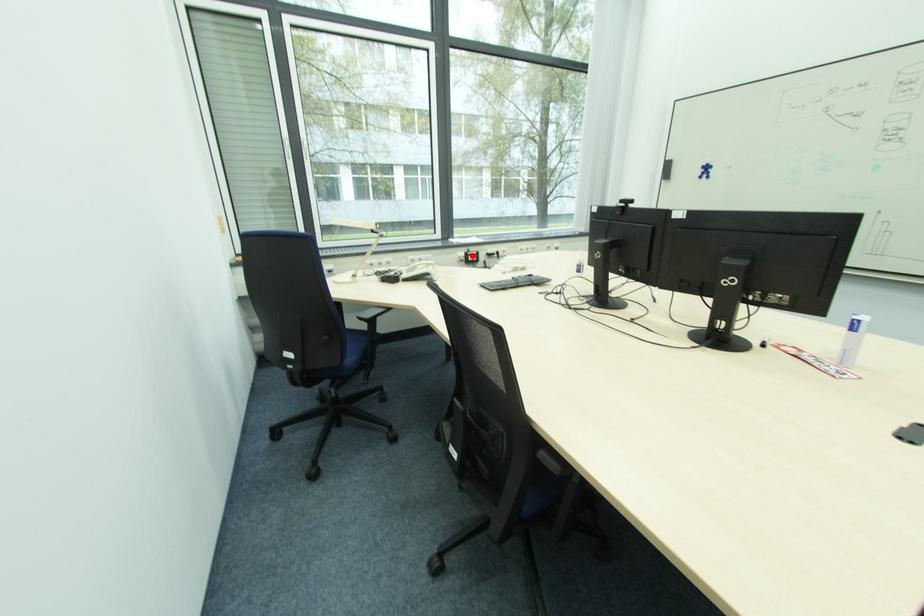
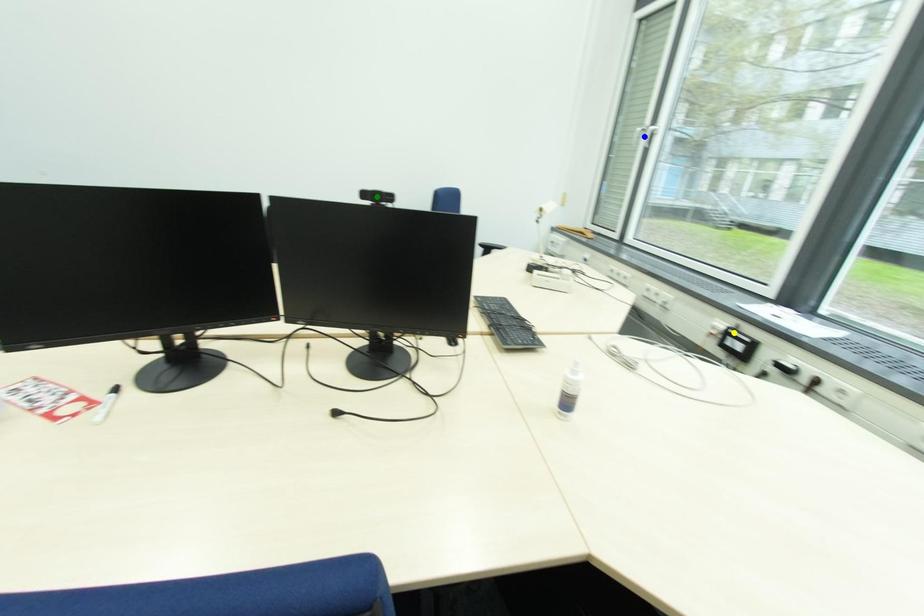
Question: I am providing you with two images of the same scene from different viewpoints. A red point is marked on the first image. You are given multiple points on the second image. Which point in image 2 represents the same 3d spot as the red point in image 1?

Choices:
 (A) green point
 (B) blue point
 (C) yellow point

Answer: (C)